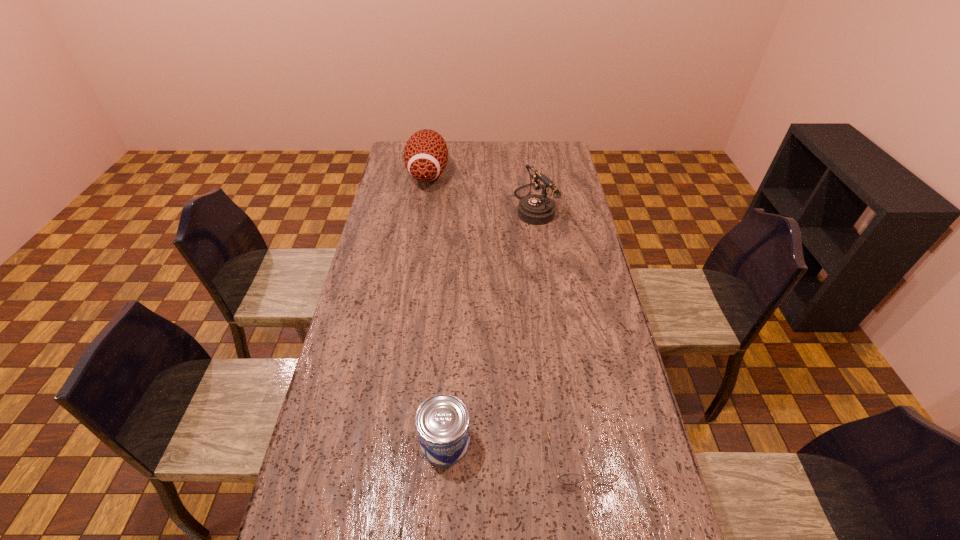
This screenshot has width=960, height=540. Find the location of `the tallest object`. the tallest object is located at coordinates (426, 154).

Where is `the second tallest object`? The width and height of the screenshot is (960, 540). the second tallest object is located at coordinates (535, 209).

At what (x,y) coordinates should I click in order to perform the action: click on the third tallest object. Please return your answer as a coordinate pair (x, y). The height and width of the screenshot is (540, 960). Looking at the image, I should click on (442, 421).

Where is `the shortest object`? The width and height of the screenshot is (960, 540). the shortest object is located at coordinates (567, 478).

Locate an element on the screen. free space located on the front of the football is located at coordinates (420, 220).

Identify the location of blank area located 0.360m on the front of the telephone. (547, 289).

Find the location of `vacant position located 0.050m on the front label of the can`. vacant position located 0.050m on the front label of the can is located at coordinates (443, 488).

Image resolution: width=960 pixels, height=540 pixels. In order to click on vacant position located on the temples of the spectacles in this screenshot , I will do 594,534.

Where is `object at the far edge`? This screenshot has width=960, height=540. object at the far edge is located at coordinates (426, 154).

At what (x,y) coordinates should I click in order to perform the action: click on object located in the left edge section of the desktop. Please return your answer as a coordinate pair (x, y). This screenshot has height=540, width=960. Looking at the image, I should click on (426, 154).